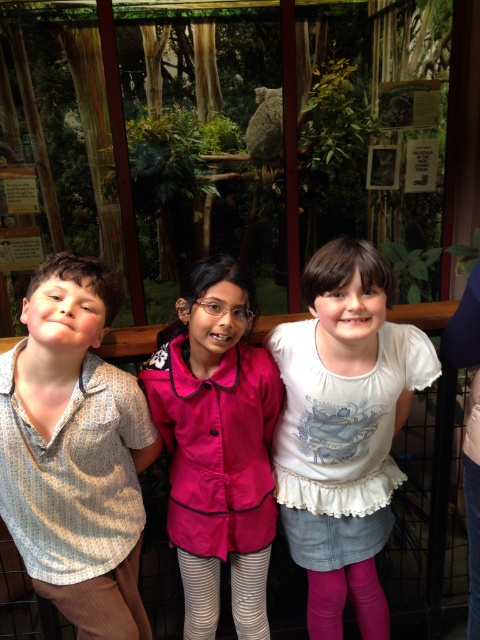
Question: Which point is closer to the camera taking this photo?

Choices:
 (A) (178, 445)
 (B) (78, 324)

Answer: (B)

Question: Which object appears closest to the camera in this image?

Choices:
 (A) white cotton shirt at center
 (B) pink fabric shirt at center
 (C) light brown textured shirt at left

Answer: (C)

Question: Based on their relative distances, which object is farther from the pink fabric shirt at center?

Choices:
 (A) light brown textured shirt at left
 (B) white cotton shirt at center

Answer: (A)

Question: Is light brown textured shirt at left smaller than white cotton shirt at center?

Choices:
 (A) yes
 (B) no

Answer: (A)

Question: Is light brown textured shirt at left thinner than white cotton shirt at center?

Choices:
 (A) no
 (B) yes

Answer: (B)

Question: Does white cotton shirt at center have a lesser width compared to pink fabric shirt at center?

Choices:
 (A) yes
 (B) no

Answer: (B)